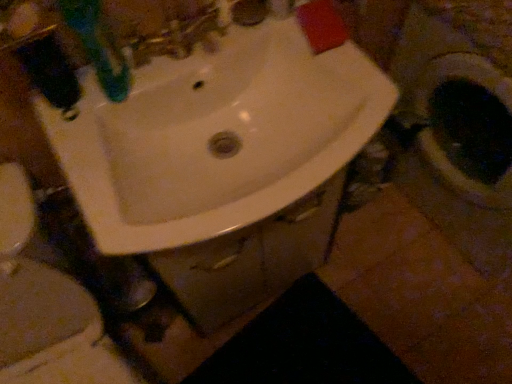
Question: Would you say black matte rug at lower center is outside green plastic toothbrush at upper left?

Choices:
 (A) no
 (B) yes

Answer: (B)

Question: From the image's perspective, would you say black matte rug at lower center is positioned over green plastic toothbrush at upper left?

Choices:
 (A) no
 (B) yes

Answer: (A)

Question: Is black matte rug at lower center further to camera compared to green plastic toothbrush at upper left?

Choices:
 (A) no
 (B) yes

Answer: (B)

Question: Can you confirm if black matte rug at lower center is thinner than green plastic toothbrush at upper left?

Choices:
 (A) yes
 (B) no

Answer: (B)

Question: Are black matte rug at lower center and green plastic toothbrush at upper left far apart?

Choices:
 (A) no
 (B) yes

Answer: (A)

Question: Does black matte rug at lower center come in front of green plastic toothbrush at upper left?

Choices:
 (A) yes
 (B) no

Answer: (B)

Question: Considering the relative positions of green plastic toothbrush at upper left and white glossy toilet at center in the image provided, is green plastic toothbrush at upper left to the right of white glossy toilet at center from the viewer's perspective?

Choices:
 (A) no
 (B) yes

Answer: (B)

Question: Is green plastic toothbrush at upper left turned away from white glossy toilet at center?

Choices:
 (A) yes
 (B) no

Answer: (B)

Question: Can you confirm if green plastic toothbrush at upper left is thinner than white glossy toilet at center?

Choices:
 (A) no
 (B) yes

Answer: (B)

Question: Is green plastic toothbrush at upper left outside white glossy toilet at center?

Choices:
 (A) yes
 (B) no

Answer: (A)

Question: Does green plastic toothbrush at upper left have a larger size compared to white glossy toilet at center?

Choices:
 (A) yes
 (B) no

Answer: (B)

Question: Could you tell me if green plastic toothbrush at upper left is facing white glossy toilet at center?

Choices:
 (A) yes
 (B) no

Answer: (B)

Question: Considering the relative sizes of white glossy sink at center and green plastic toothbrush at upper left in the image provided, is white glossy sink at center wider than green plastic toothbrush at upper left?

Choices:
 (A) no
 (B) yes

Answer: (B)